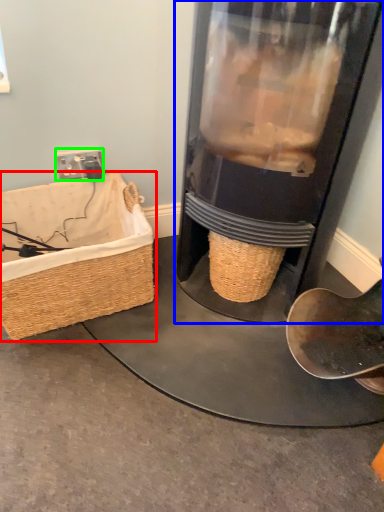
Question: Based on their relative distances, which object is nearer to picnic basket (highlighted by a red box)? Choose from appliance (highlighted by a blue box) and plug (highlighted by a green box).

Choices:
 (A) appliance
 (B) plug

Answer: (B)